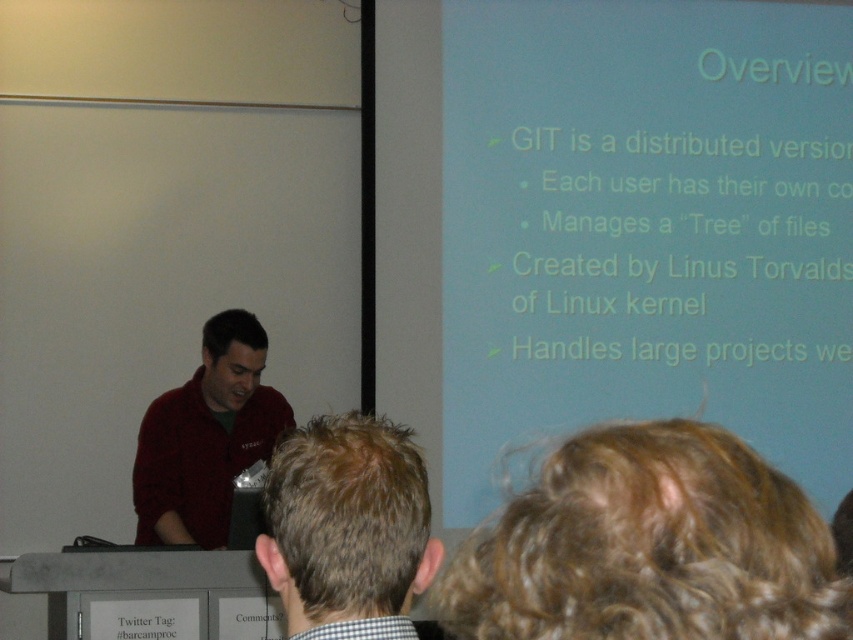
You are an attendee at the presentation. You notice two people in the audience. One has brown hair at center and another is wearing a matte red sweater at left. Which person is closer to the front of the room?

The brown hair at center is closer to the front of the room because it is in front of the matte red sweater at left.

You are an attendee at the presentation and you want to take a photo of the speaker. The speaker has brown hair at center and is wearing a matte red sweater at left. Which object should you focus on first to ensure both are in frame?

You should focus on the matte red sweater at left first because it is larger in size compared to the brown hair at center, ensuring both objects remain in the frame.

You are an attendee at the presentation. You notice two objects in the front row of the audience. One is the brown hair at center and the other is the matte red sweater at left. Which object appears narrower from your perspective?

The brown hair at center appears narrower because it has a lesser width compared to the matte red sweater at left.